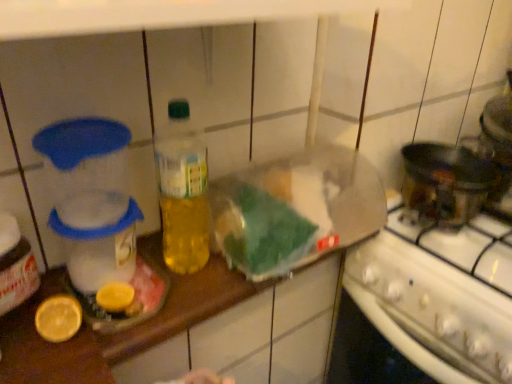
Question: Can you confirm if yellow matte lemon at lower left is smaller than translucent plastic bottle at center?

Choices:
 (A) no
 (B) yes

Answer: (B)

Question: Does yellow matte lemon at lower left appear on the left side of translucent plastic bottle at center?

Choices:
 (A) no
 (B) yes

Answer: (B)

Question: Is yellow matte lemon at lower left in contact with translucent plastic bottle at center?

Choices:
 (A) yes
 (B) no

Answer: (B)

Question: From the image's perspective, is yellow matte lemon at lower left above translucent plastic bottle at center?

Choices:
 (A) no
 (B) yes

Answer: (A)

Question: Can you confirm if yellow matte lemon at lower left is wider than translucent plastic bottle at center?

Choices:
 (A) no
 (B) yes

Answer: (A)

Question: From a real-world perspective, is yellow matte lemon at lower left below translucent plastic bottle at center?

Choices:
 (A) no
 (B) yes

Answer: (B)

Question: Is white glossy stove at lower right shorter than yellow matte lemon at lower left?

Choices:
 (A) no
 (B) yes

Answer: (A)

Question: Is white glossy stove at lower right facing away from yellow matte lemon at lower left?

Choices:
 (A) yes
 (B) no

Answer: (B)

Question: Considering the relative positions of white glossy stove at lower right and yellow matte lemon at lower left in the image provided, is white glossy stove at lower right in front of yellow matte lemon at lower left?

Choices:
 (A) yes
 (B) no

Answer: (B)

Question: Does white glossy stove at lower right have a greater height compared to yellow matte lemon at lower left?

Choices:
 (A) no
 (B) yes

Answer: (B)

Question: Does white glossy stove at lower right turn towards yellow matte lemon at lower left?

Choices:
 (A) yes
 (B) no

Answer: (A)

Question: Considering the relative sizes of white glossy stove at lower right and yellow matte lemon at lower left in the image provided, is white glossy stove at lower right thinner than yellow matte lemon at lower left?

Choices:
 (A) yes
 (B) no

Answer: (B)

Question: Can white glossy stove at lower right be found inside translucent plastic bottle at center?

Choices:
 (A) no
 (B) yes

Answer: (A)